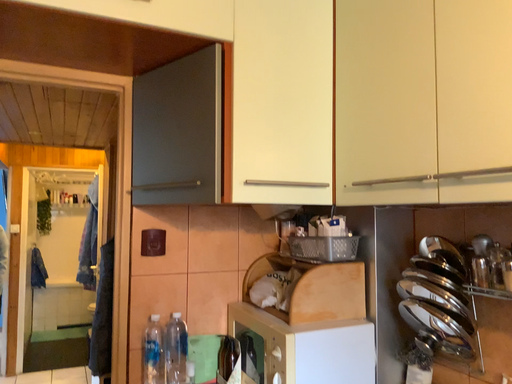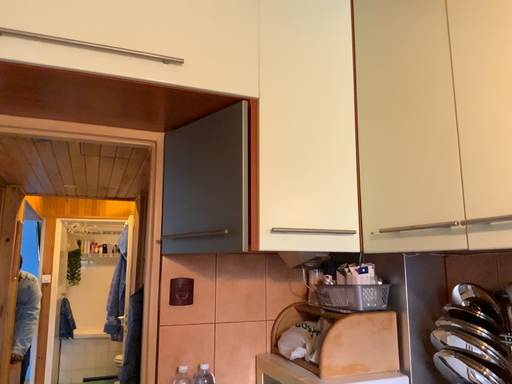
Question: Which way did the camera rotate in the video?

Choices:
 (A) rotated upward
 (B) rotated downward

Answer: (A)